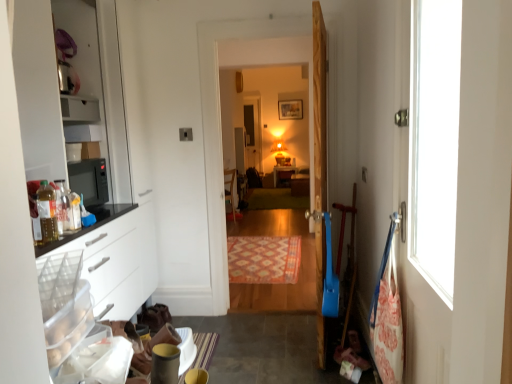
Question: From the image's perspective, is wooden door at center positioned above or below matte white cabinet at center?

Choices:
 (A) above
 (B) below

Answer: (B)

Question: Considering the positions of wooden door at center and matte white cabinet at center in the image, is wooden door at center wider or thinner than matte white cabinet at center?

Choices:
 (A) thin
 (B) wide

Answer: (A)

Question: Based on their relative distances, which object is farther from the wooden door at center?

Choices:
 (A) wooden chair at center
 (B) wooden table at center
 (C) green carpet at center, which is the 2th mat from front to back
 (D) carpeted wooden floor at center
 (E) translucent plastic bottle at left

Answer: (D)

Question: Estimate the real-world distances between objects in this image. Which object is closer to the wooden chair at center?

Choices:
 (A) patterned carpet at center, which is the 1th mat from bottom to top
 (B) wooden table at center
 (C) carpeted wooden floor at center
 (D) green carpet at center, which is the 2th mat from front to back
 (E) matte yellow concrete at lower left

Answer: (D)